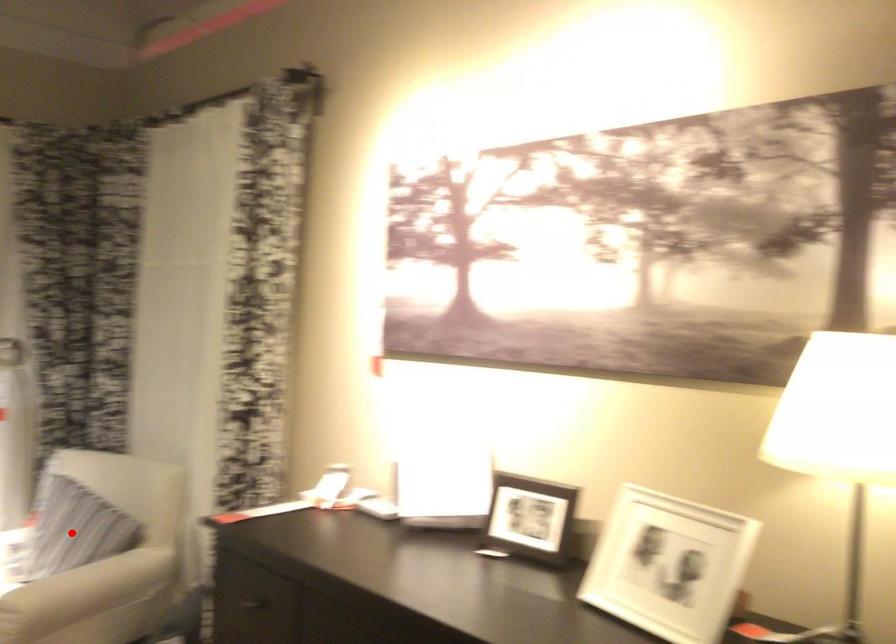
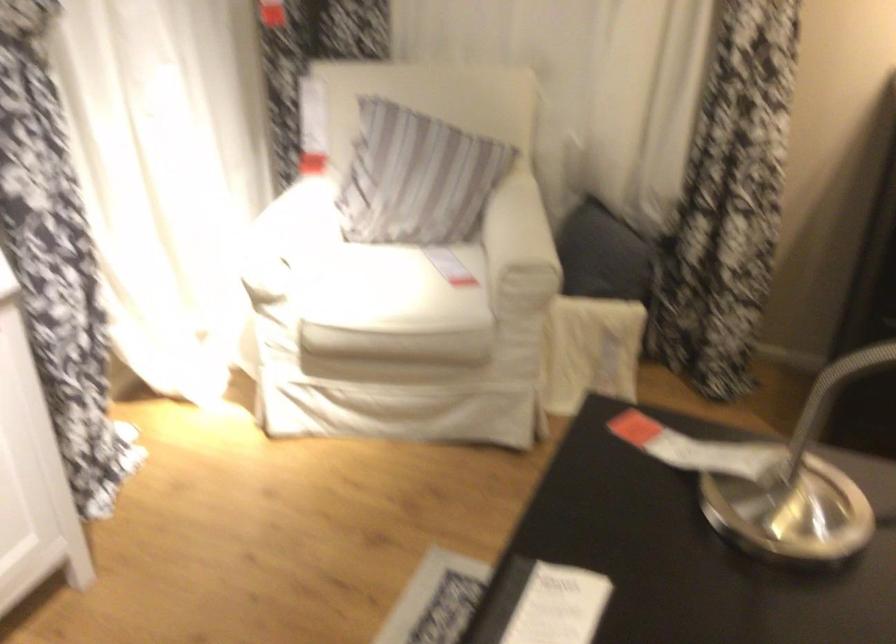
Question: I am providing you with two images of the same scene from different viewpoints. Image1 has a red point marked. In image2, the corresponding 3D location appears at what relative position? Reply with the corresponding letter.

Choices:
 (A) Closer
 (B) Farther

Answer: (A)